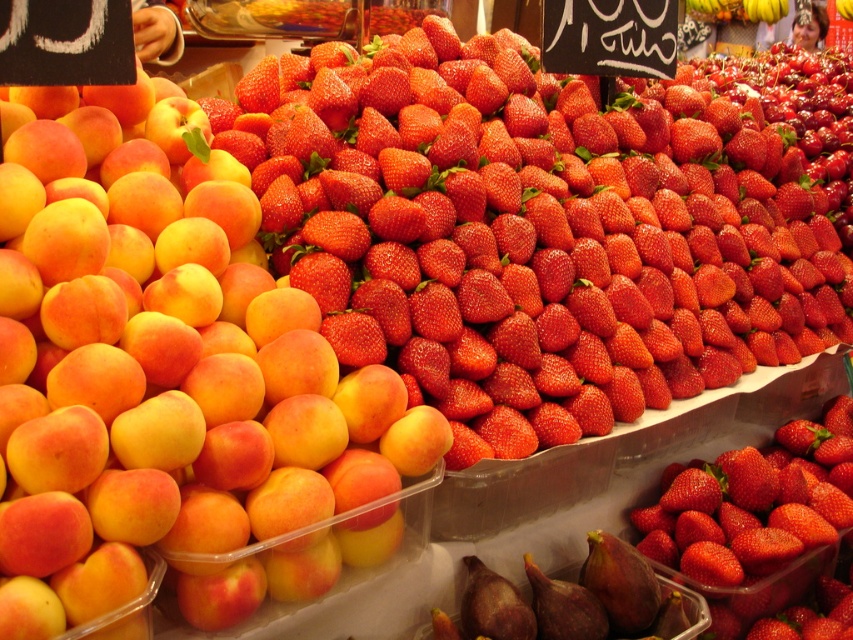
Who is positioned more to the right, matte yellow-orange peach at left or red matte strawberry at center?

Positioned to the right is red matte strawberry at center.

Between matte yellow-orange peach at left and red matte strawberry at center, which one is positioned higher?

matte yellow-orange peach at left is higher up.

The height and width of the screenshot is (640, 853). Identify the location of matte yellow-orange peach at left. (161, 371).